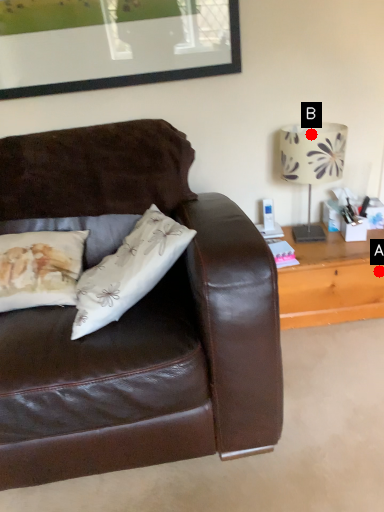
Question: Two points are circled on the image, labeled by A and B beside each circle. Among these points, which one is nearest to the camera?

Choices:
 (A) A is closer
 (B) B is closer

Answer: (B)